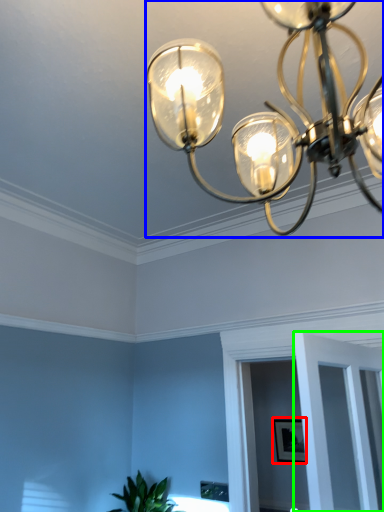
Question: Which object is positioned farthest from picture frame (highlighted by a red box)? Select from lamp (highlighted by a blue box) and glass door (highlighted by a green box).

Choices:
 (A) lamp
 (B) glass door

Answer: (A)